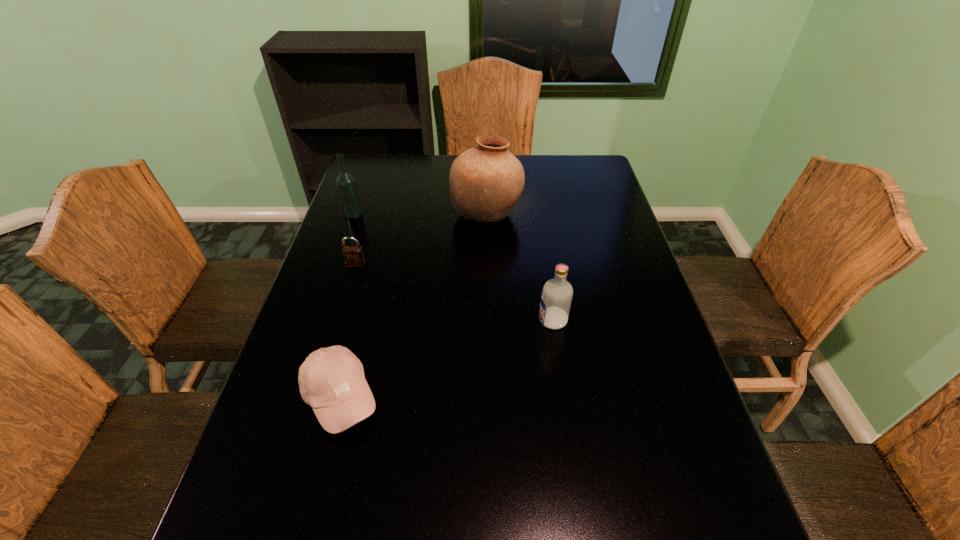
In order to click on the tallest object in this screenshot , I will do `click(486, 181)`.

This screenshot has width=960, height=540. I want to click on pottery, so click(x=486, y=181).

The width and height of the screenshot is (960, 540). I want to click on the farther vodka, so click(x=346, y=183).

The image size is (960, 540). Find the location of `the left vodka`. the left vodka is located at coordinates (346, 183).

Identify the location of the rightmost object. The width and height of the screenshot is (960, 540). (556, 297).

At what (x,y) coordinates should I click in order to perform the action: click on the right vodka. Please return your answer as a coordinate pair (x, y). The width and height of the screenshot is (960, 540). Looking at the image, I should click on (556, 297).

You are a GUI agent. You are given a task and a screenshot of the screen. Output one action in this format:
    pyautogui.click(x=<x>, y=<y>)
    Task: Click on the baseball cap
    
    Given the screenshot: What is the action you would take?
    pyautogui.click(x=331, y=380)

The height and width of the screenshot is (540, 960). I want to click on the third farthest object, so click(353, 255).

Identify the location of vacant space situated 0.180m on the back of the second object from right to left. The width and height of the screenshot is (960, 540). (486, 167).

Identify the location of vacant region located 0.140m on the front of the left vodka. (342, 247).